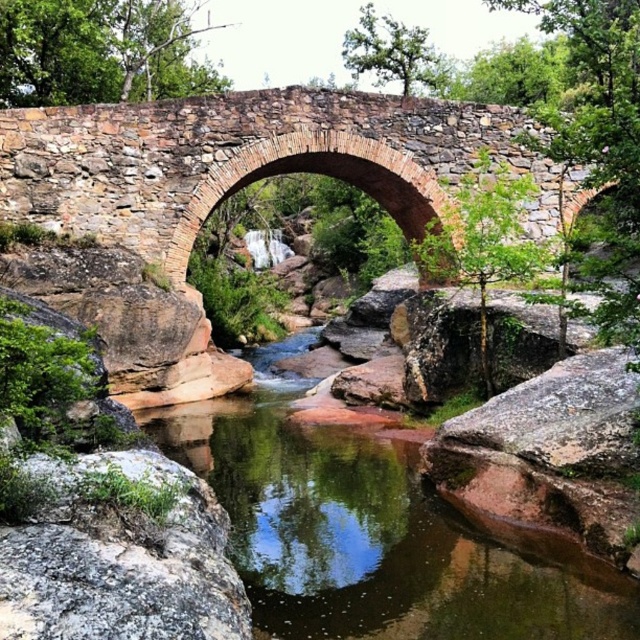
Question: Is rustic stone bridge at center to the left of gray/granite boulder at lower left from the viewer's perspective?

Choices:
 (A) no
 (B) yes

Answer: (A)

Question: Among these points, which one is nearest to the camera?

Choices:
 (A) (324, 611)
 (B) (109, 150)
 (C) (147, 564)

Answer: (C)

Question: Estimate the real-world distances between objects in this image. Which object is closer to the rustic stone bridge at center?

Choices:
 (A) gray/granite boulder at lower left
 (B) smooth rock river at center

Answer: (B)

Question: Is the position of smooth rock river at center more distant than that of rustic stone bridge at center?

Choices:
 (A) yes
 (B) no

Answer: (B)

Question: Can you confirm if smooth rock river at center is positioned below gray/granite boulder at lower left?

Choices:
 (A) yes
 (B) no

Answer: (A)

Question: Which of the following is the farthest from the observer?

Choices:
 (A) gray/granite boulder at lower left
 (B) rustic stone bridge at center

Answer: (B)